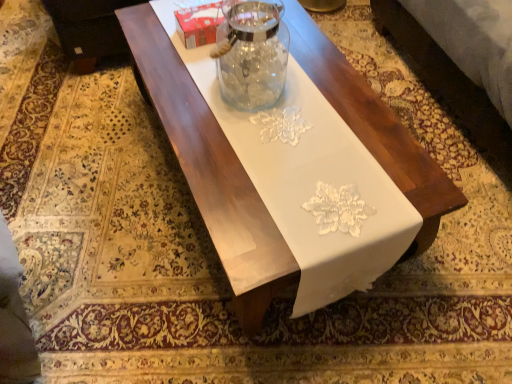
Question: Would you say black leather couch at upper left is a long distance from transparent glass jar at center?

Choices:
 (A) no
 (B) yes

Answer: (A)

Question: Considering the relative sizes of black leather couch at upper left and transparent glass jar at center in the image provided, is black leather couch at upper left bigger than transparent glass jar at center?

Choices:
 (A) no
 (B) yes

Answer: (B)

Question: From the image's perspective, does black leather couch at upper left appear higher than transparent glass jar at center?

Choices:
 (A) yes
 (B) no

Answer: (A)

Question: Is the depth of black leather couch at upper left greater than that of transparent glass jar at center?

Choices:
 (A) no
 (B) yes

Answer: (B)

Question: From the image's perspective, is black leather couch at upper left below transparent glass jar at center?

Choices:
 (A) yes
 (B) no

Answer: (B)

Question: From a real-world perspective, is black leather couch at upper left on transparent glass jar at center?

Choices:
 (A) yes
 (B) no

Answer: (B)

Question: Is transparent glass jar at center at the right side of black leather couch at upper left?

Choices:
 (A) yes
 (B) no

Answer: (A)

Question: From the image's perspective, is transparent glass jar at center located above black leather couch at upper left?

Choices:
 (A) no
 (B) yes

Answer: (A)

Question: Does transparent glass jar at center turn towards black leather couch at upper left?

Choices:
 (A) yes
 (B) no

Answer: (B)

Question: Could black leather couch at upper left be considered to be inside transparent glass jar at center?

Choices:
 (A) yes
 (B) no

Answer: (B)

Question: Is transparent glass jar at center bigger than black leather couch at upper left?

Choices:
 (A) yes
 (B) no

Answer: (B)

Question: Does transparent glass jar at center have a lesser height compared to black leather couch at upper left?

Choices:
 (A) yes
 (B) no

Answer: (A)

Question: From the image's perspective, would you say black leather couch at upper left is positioned over white glossy table at center?

Choices:
 (A) yes
 (B) no

Answer: (A)